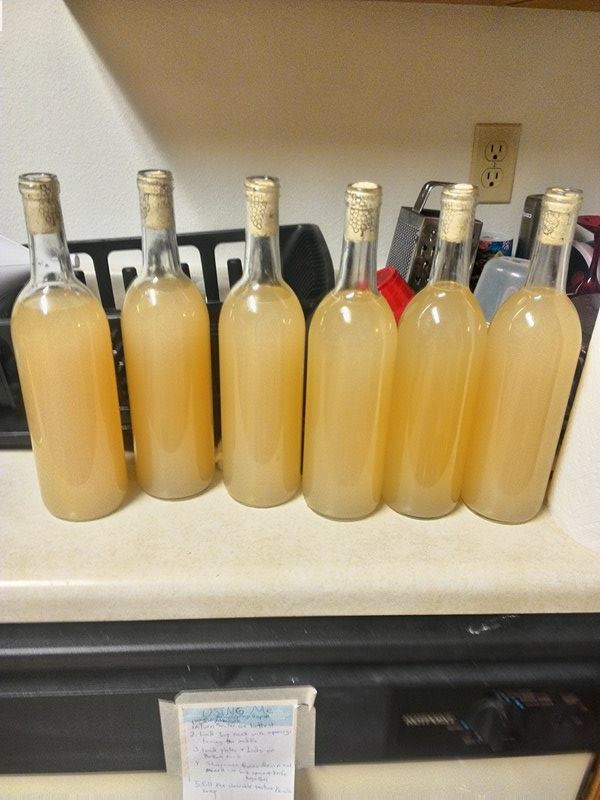
You are a GUI agent. You are given a task and a screenshot of the screen. Output one action in this format:
    pyautogui.click(x=<x>, y=<y>)
    Task: Click on the dial on washing machine
    The image size is (600, 800).
    Given the screenshot: What is the action you would take?
    pyautogui.click(x=496, y=701)